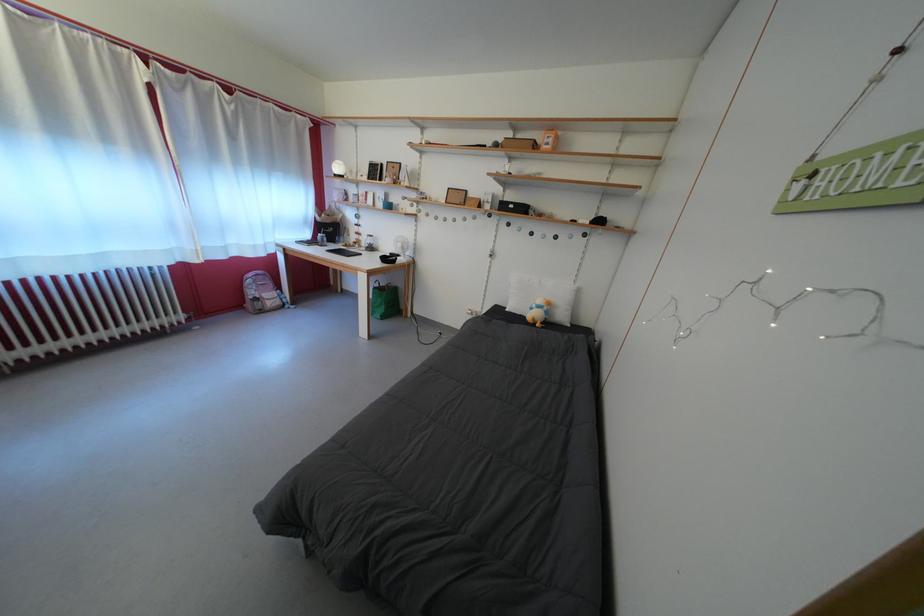
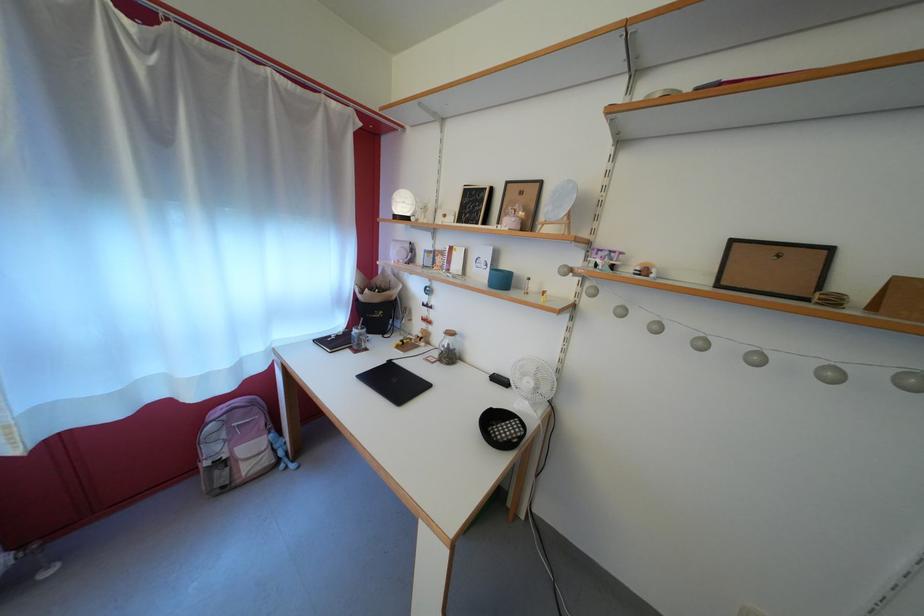
Which direction would the cameraman need to move to produce the second image?

The movement direction of the cameraman is left, forward.